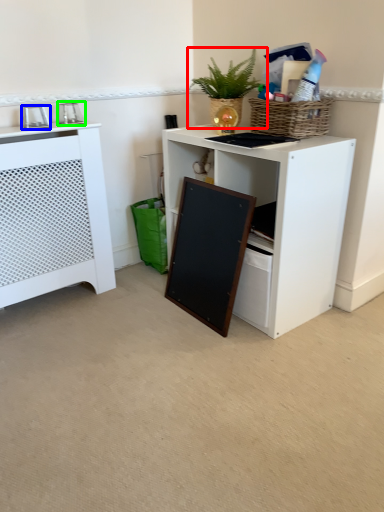
Question: Which object is positioned farthest from houseplant (highlighted by a red box)? Select from appliance (highlighted by a blue box) and appliance (highlighted by a green box).

Choices:
 (A) appliance
 (B) appliance

Answer: (A)